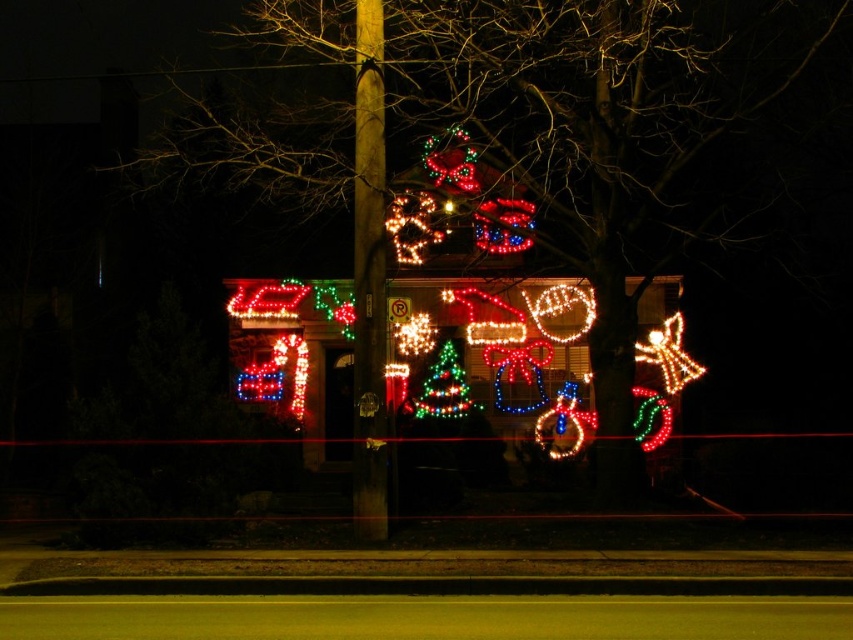
You are a visitor arriving at the house and want to take a photo of both the illuminated lights at center and the green matte christmas tree at center. Which object should you focus on first to ensure both are fully visible in the frame?

The illuminated lights at center are wider than the green matte christmas tree at center, so you should focus on the illuminated lights at center first to ensure both fit in the frame.

You are standing in front of the house and want to locate the illuminated lights at center. According to the coordinates provided, where exactly would you look?

The illuminated lights at center are located at point coordinates [534,131].

Looking at this image, you are a delivery person approaching the house and need to locate the front door. The illuminated lights at center and the smooth wooden pole at center are both in your line of sight. Which object is closer to you as you approach the house?

The illuminated lights at center are closer to you because they are positioned in front of the smooth wooden pole at center, meaning the pole is behind them from your perspective.